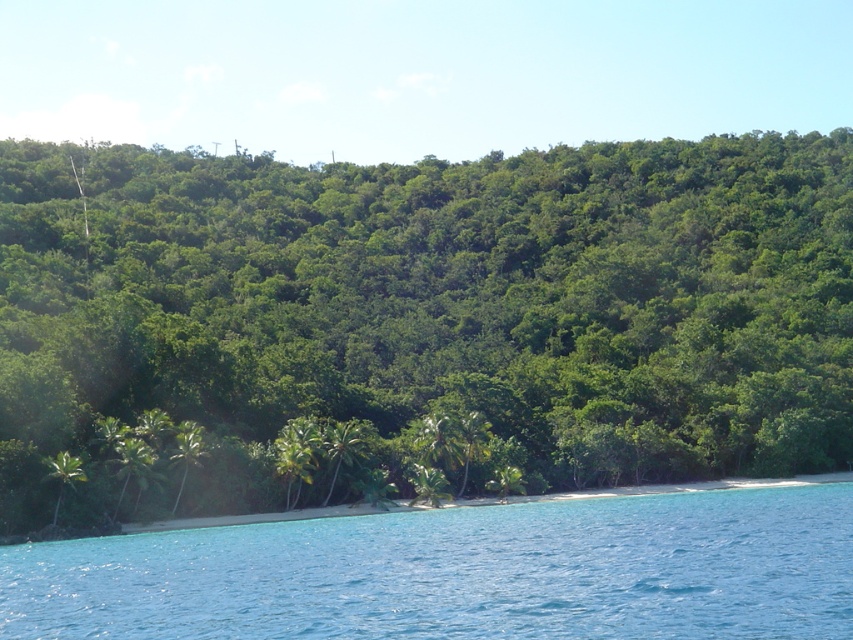
Can you confirm if clear blue water at lower center is shorter than green leafy palm tree at lower left?

No, clear blue water at lower center is not shorter than green leafy palm tree at lower left.

Which is behind, point (91, 636) or point (73, 483)?

Positioned behind is point (73, 483).

Between point (395, 576) and point (74, 480), which one is positioned behind?

The point (74, 480) is more distant.

Identify the location of clear blue water at lower center. (461, 572).

Describe the element at coordinates (418, 321) in the screenshot. I see `green leafy trees at lower center` at that location.

Who is more distant from viewer, (x=247, y=444) or (x=57, y=461)?

Positioned behind is point (x=247, y=444).

Where is `green leafy trees at lower center`? Image resolution: width=853 pixels, height=640 pixels. green leafy trees at lower center is located at coordinates (418, 321).

Is green leafy trees at lower center wider than clear blue water at lower center?

Indeed, green leafy trees at lower center has a greater width compared to clear blue water at lower center.

Which is behind, point (282, 358) or point (404, 563)?

The point (282, 358) is behind.

You are a GUI agent. You are given a task and a screenshot of the screen. Output one action in this format:
    pyautogui.click(x=<x>, y=<y>)
    Task: Click on the green leafy trees at lower center
    The height and width of the screenshot is (640, 853).
    Given the screenshot: What is the action you would take?
    pyautogui.click(x=418, y=321)